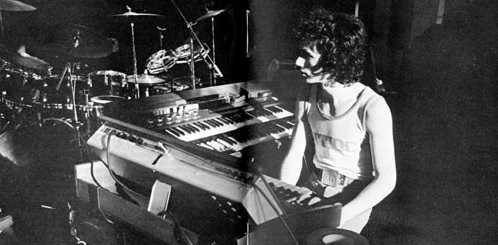
Image resolution: width=498 pixels, height=245 pixels. Find the location of `socket`. socket is located at coordinates (123, 133).